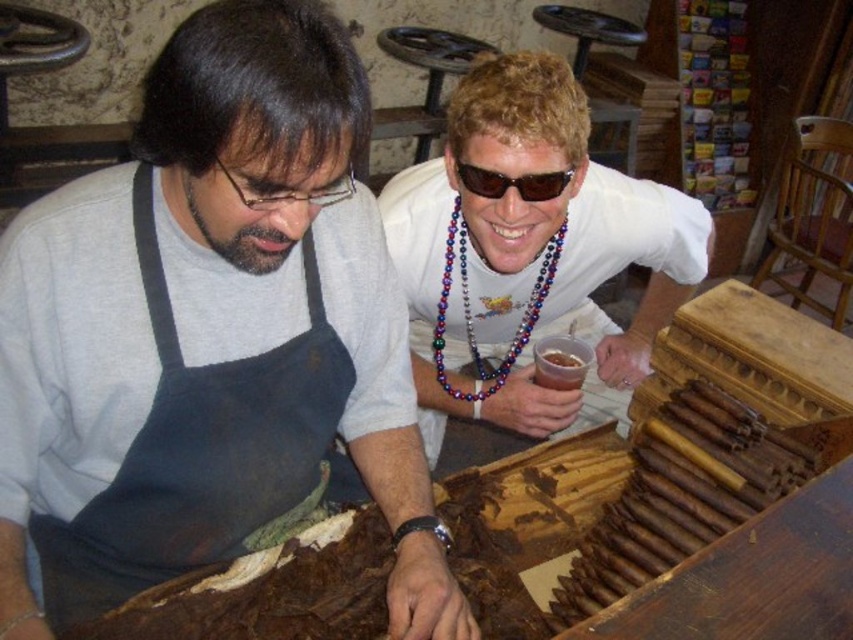
Can you confirm if multicolored beaded necklace at upper center is taller than sunglasses at upper center?

Yes.

Is point (531, 324) farther from viewer compared to point (553, 186)?

Yes, point (531, 324) is farther from viewer.

Who is more forward, [463,298] or [462,164]?

Point [462,164]

I want to click on multicolored beaded necklace at upper center, so click(469, 310).

Does point (590, 180) come in front of point (553, 184)?

No, it is behind (553, 184).

Is white matte shirt at upper center smaller than sunglasses at upper center?

No.

Image resolution: width=853 pixels, height=640 pixels. What do you see at coordinates (532, 250) in the screenshot?
I see `white matte shirt at upper center` at bounding box center [532, 250].

At what (x,y) coordinates should I click in order to perform the action: click on white matte shirt at upper center. Please return your answer as a coordinate pair (x, y). The height and width of the screenshot is (640, 853). Looking at the image, I should click on (532, 250).

Between white matte shirt at upper center and multicolored beaded necklace at upper center, which one has more height?

Standing taller between the two is white matte shirt at upper center.

Is white matte shirt at upper center further to camera compared to multicolored beaded necklace at upper center?

That is False.

Locate an element on the screen. white matte shirt at upper center is located at coordinates (532, 250).